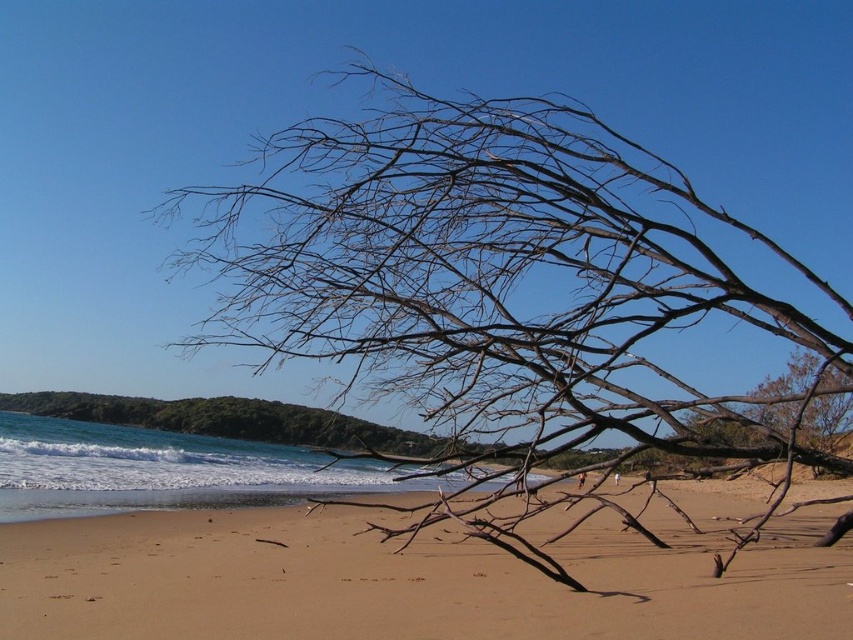
Which of these two, brown/dry wood at center or brown sandy beach at center, stands shorter?

Standing shorter between the two is brown sandy beach at center.

Which is in front, point (682, 266) or point (612, 525)?

Point (682, 266) is in front.

This screenshot has height=640, width=853. Identify the location of brown/dry wood at center. (497, 278).